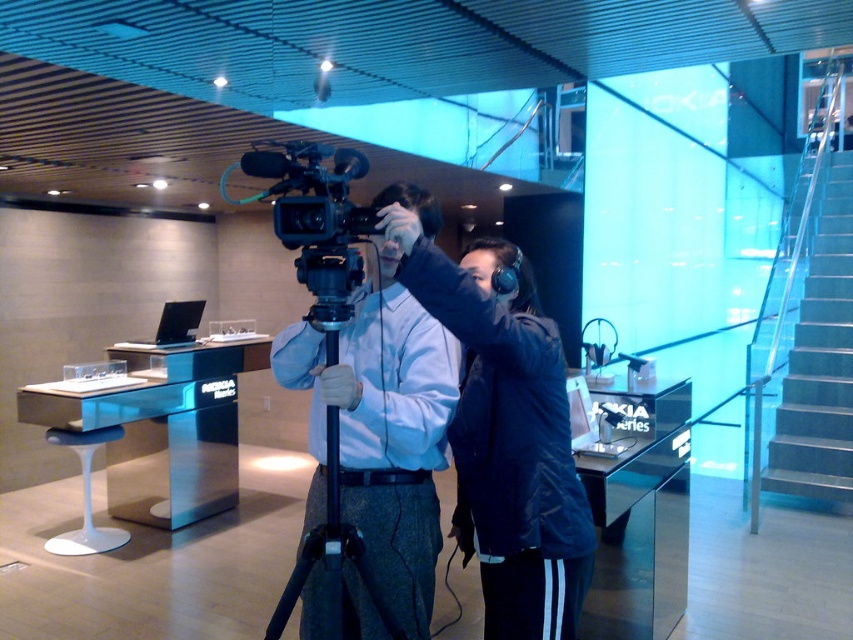
Question: Which of the following is the farthest from the observer?

Choices:
 (A) (341, 284)
 (B) (293, 600)

Answer: (B)

Question: Which point appears farthest from the camera in this image?

Choices:
 (A) (329, 205)
 (B) (567, 628)

Answer: (B)

Question: Observing the image, what is the correct spatial positioning of dark blue jacket at center in reference to black plastic video camera at center?

Choices:
 (A) right
 (B) left

Answer: (A)

Question: Which point is farther to the camera?

Choices:
 (A) black plastic tripod at center
 (B) dark blue jacket at center
 (C) black plastic video camera at center

Answer: (C)

Question: Is black plastic video camera at center thinner than black plastic tripod at center?

Choices:
 (A) no
 (B) yes

Answer: (B)

Question: Is black plastic video camera at center above black plastic tripod at center?

Choices:
 (A) yes
 (B) no

Answer: (A)